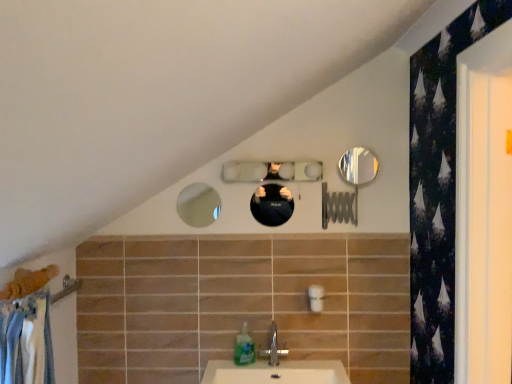
Question: In which direction should I rotate to look at shiny black mirror at center, arranged as the 3th mirror when viewed from the right?

Choices:
 (A) left
 (B) right

Answer: (B)

Question: Can you confirm if shiny black mirror at center, the second mirror from the left, is bigger than clear glass mirror at center, placed as the second mirror when sorted from right to left?

Choices:
 (A) yes
 (B) no

Answer: (B)

Question: Can you confirm if shiny black mirror at center, arranged as the 3th mirror when viewed from the right, is taller than clear glass mirror at center, placed as the second mirror when sorted from right to left?

Choices:
 (A) yes
 (B) no

Answer: (A)

Question: Is clear glass mirror at center, placed as the second mirror when sorted from right to left, surrounded by shiny black mirror at center, the second mirror from the left?

Choices:
 (A) no
 (B) yes

Answer: (A)

Question: From a real-world perspective, is shiny black mirror at center, arranged as the 3th mirror when viewed from the right, located beneath clear glass mirror at center, placed as the second mirror when sorted from right to left?

Choices:
 (A) no
 (B) yes

Answer: (B)

Question: Can we say shiny black mirror at center, arranged as the 3th mirror when viewed from the right, lies outside clear glass mirror at center, placed as the second mirror when sorted from right to left?

Choices:
 (A) yes
 (B) no

Answer: (A)

Question: Would you say shiny black mirror at center, the second mirror from the left, is a long distance from clear glass mirror at center, placed as the second mirror when sorted from right to left?

Choices:
 (A) yes
 (B) no

Answer: (B)

Question: Can you confirm if shiny black mirror at center, the second mirror from the left, is bigger than translucent plastic soap dispenser at lower center?

Choices:
 (A) no
 (B) yes

Answer: (A)

Question: Is the position of shiny black mirror at center, the second mirror from the left, less distant than that of translucent plastic soap dispenser at lower center?

Choices:
 (A) yes
 (B) no

Answer: (B)

Question: Considering the relative positions of shiny black mirror at center, the second mirror from the left, and translucent plastic soap dispenser at lower center in the image provided, is shiny black mirror at center, the second mirror from the left, to the left of translucent plastic soap dispenser at lower center from the viewer's perspective?

Choices:
 (A) no
 (B) yes

Answer: (A)

Question: From a real-world perspective, is shiny black mirror at center, the second mirror from the left, under translucent plastic soap dispenser at lower center?

Choices:
 (A) no
 (B) yes

Answer: (A)

Question: From a real-world perspective, is shiny black mirror at center, the second mirror from the left, on top of translucent plastic soap dispenser at lower center?

Choices:
 (A) no
 (B) yes

Answer: (B)

Question: Can you confirm if shiny black mirror at center, arranged as the 3th mirror when viewed from the right, is shorter than translucent plastic soap dispenser at lower center?

Choices:
 (A) yes
 (B) no

Answer: (A)

Question: Considering the relative sizes of shiny black mirror at center, the second mirror from the left, and matte glass mirror at upper center, acting as the first mirror starting from the left, in the image provided, is shiny black mirror at center, the second mirror from the left, bigger than matte glass mirror at upper center, acting as the first mirror starting from the left,?

Choices:
 (A) no
 (B) yes

Answer: (B)